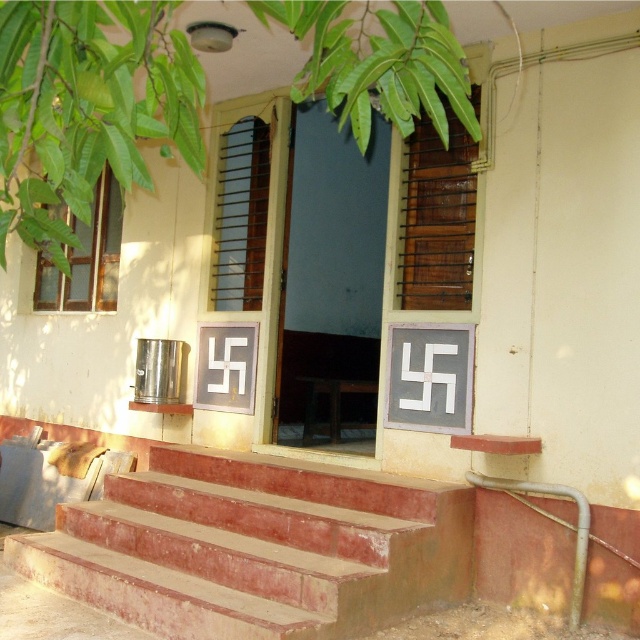
Question: Which point is closer to the camera taking this photo?

Choices:
 (A) (253, 177)
 (B) (454, 156)

Answer: (B)

Question: Is smooth concrete stairs at center bigger than brown wooden shutter at center?

Choices:
 (A) yes
 (B) no

Answer: (A)

Question: Does smooth concrete stairs at center have a lesser width compared to brown wooden shutter at center?

Choices:
 (A) yes
 (B) no

Answer: (B)

Question: Estimate the real-world distances between objects in this image. Which object is closer to the brown wooden shutter at center?

Choices:
 (A) brown wooden shutter at upper center
 (B) smooth concrete stairs at center

Answer: (A)

Question: Is brown wooden shutter at upper center thinner than brown wooden shutter at center?

Choices:
 (A) yes
 (B) no

Answer: (B)

Question: Which point is closer to the camera?

Choices:
 (A) [x=307, y=545]
 (B) [x=452, y=161]
 (C) [x=225, y=147]

Answer: (A)